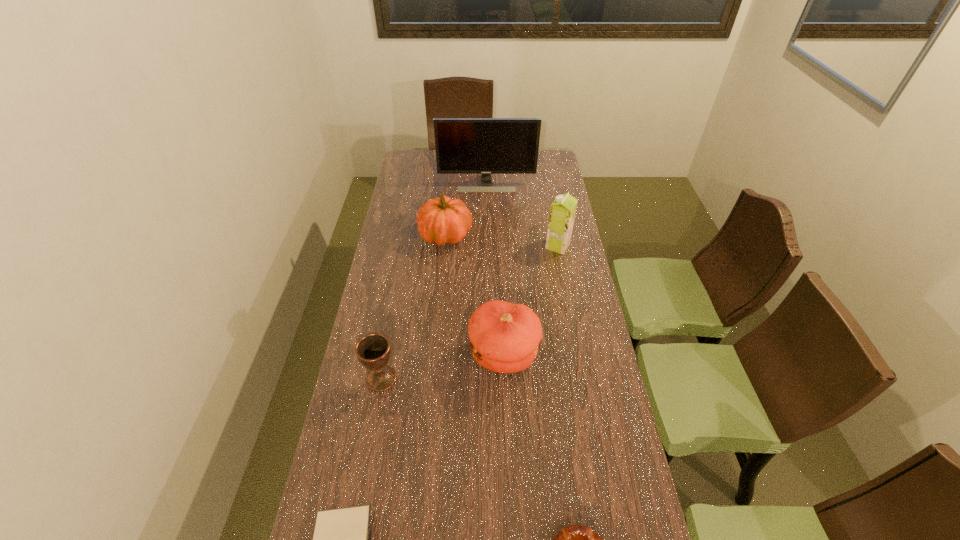
Identify the location of vacant space positioned 0.280m on the right of the fifth tallest object. This screenshot has height=540, width=960. (488, 378).

Locate an element on the screen. The height and width of the screenshot is (540, 960). pumpkin that is positioned at the left edge is located at coordinates (442, 220).

Where is `chalice present at the left edge`? chalice present at the left edge is located at coordinates (x=373, y=350).

Where is `monitor located in the right edge section of the desktop`? This screenshot has width=960, height=540. monitor located in the right edge section of the desktop is located at coordinates (x=486, y=146).

The image size is (960, 540). In order to click on soya milk that is at the right edge in this screenshot , I will do `click(562, 213)`.

Find the location of a particular element. The height and width of the screenshot is (540, 960). vacant space at the left edge is located at coordinates (397, 235).

Find the location of a particular element. vacant space at the right edge of the desktop is located at coordinates (538, 177).

In order to click on free location at the far right corner of the desktop in this screenshot , I will do `click(540, 170)`.

Identify the location of free area in between the nearer pumpkin and the farther pumpkin. This screenshot has width=960, height=540. (474, 295).

Where is `free space between the chalice and the farther pumpkin`? The width and height of the screenshot is (960, 540). free space between the chalice and the farther pumpkin is located at coordinates (414, 307).